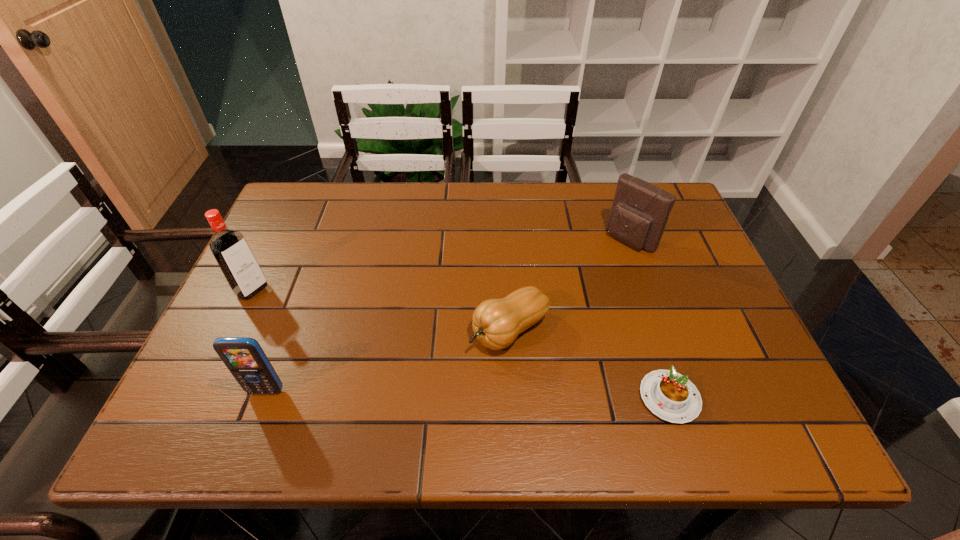
You are a GUI agent. You are given a task and a screenshot of the screen. Output one action in this format:
    pyautogui.click(x=<x>, y=<y>)
    Task: Click on the free space on the desktop that is between the second object from left to right and the pudding and is positioned with an open flap on the pouch
    Image resolution: width=960 pixels, height=540 pixels.
    Given the screenshot: What is the action you would take?
    pyautogui.click(x=456, y=394)

You are a GUI agent. You are given a task and a screenshot of the screen. Output one action in this format:
    pyautogui.click(x=<x>, y=<y>)
    Task: Click on the free space on the desktop that is between the cellular telephone and the shortest object and is positioned on the front and back of the tallest object
    The image size is (960, 540).
    Given the screenshot: What is the action you would take?
    point(423,394)

At what (x,y) coordinates should I click in order to perform the action: click on free space on the desktop that is between the fourth object from right to left and the pudding and is positioned on the stem side of the second shortest object. Please return your answer as a coordinate pair (x, y). The width and height of the screenshot is (960, 540). Looking at the image, I should click on (413, 393).